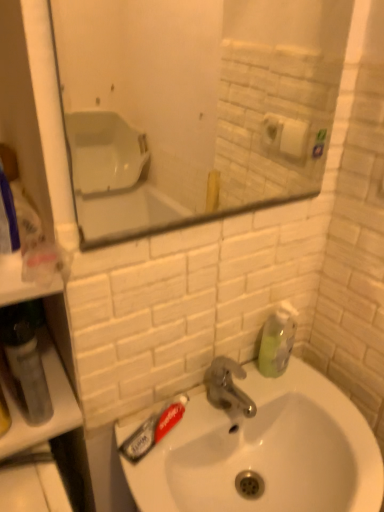
Image resolution: width=384 pixels, height=512 pixels. Identify the location of vacant area that is in front of green translucent soap dispenser at right. (319, 414).